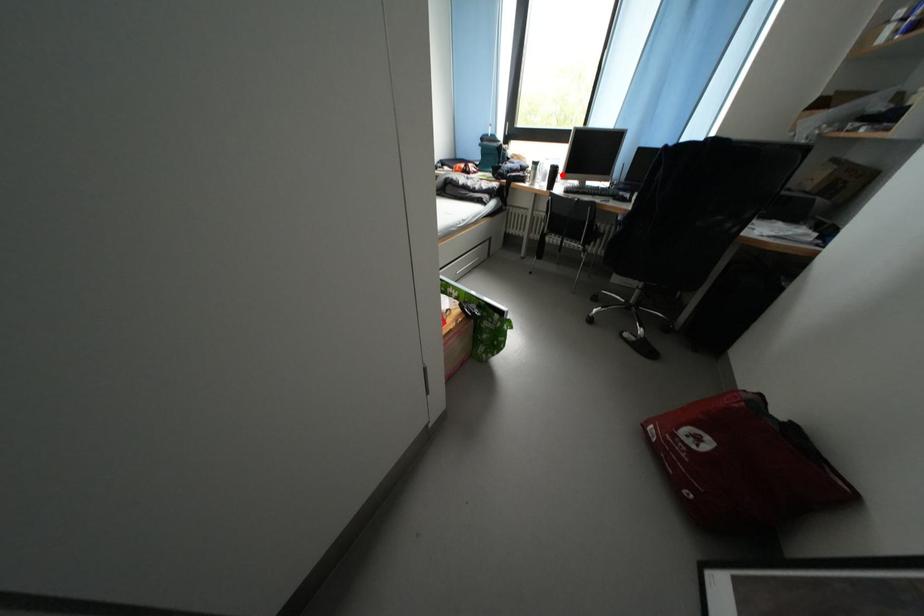
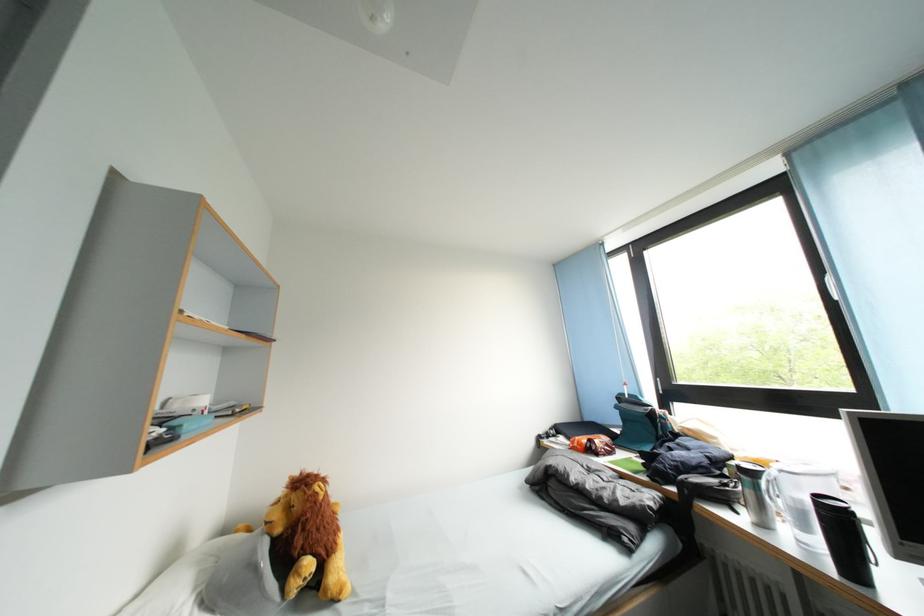
Question: I am providing you with two images of the same scene from different viewpoints. In image1, a red point is highlighted. Considering the same 3D point in image2, which of the following is correct?

Choices:
 (A) It is closer
 (B) It is farther

Answer: (B)